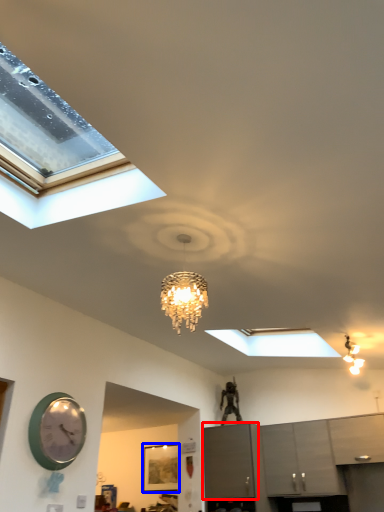
Question: Which of the following is the farthest to the observer, cabinetry (highlighted by a red box) or picture frame (highlighted by a blue box)?

Choices:
 (A) cabinetry
 (B) picture frame

Answer: (B)